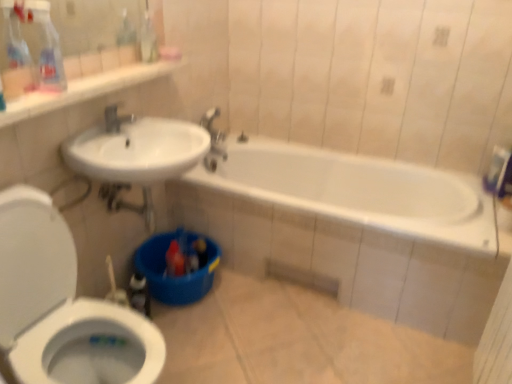
Question: From a real-world perspective, is translucent plastic spray bottle at upper left located higher than silver metallic faucet at upper center?

Choices:
 (A) yes
 (B) no

Answer: (A)

Question: Can silver metallic faucet at upper center be found inside translucent plastic spray bottle at upper left?

Choices:
 (A) no
 (B) yes

Answer: (A)

Question: Does translucent plastic spray bottle at upper left appear on the right side of silver metallic faucet at upper center?

Choices:
 (A) yes
 (B) no

Answer: (B)

Question: Is translucent plastic spray bottle at upper left further to camera compared to silver metallic faucet at upper center?

Choices:
 (A) yes
 (B) no

Answer: (B)

Question: From the image's perspective, is translucent plastic spray bottle at upper left on top of silver metallic faucet at upper center?

Choices:
 (A) yes
 (B) no

Answer: (A)

Question: Considering the relative positions of silver metallic faucet at upper center and translucent plastic spray bottle at upper left in the image provided, is silver metallic faucet at upper center to the left or to the right of translucent plastic spray bottle at upper left?

Choices:
 (A) right
 (B) left

Answer: (A)

Question: Is silver metallic faucet at upper center inside or outside of translucent plastic spray bottle at upper left?

Choices:
 (A) outside
 (B) inside

Answer: (A)

Question: Considering the positions of silver metallic faucet at upper center and translucent plastic spray bottle at upper left in the image, is silver metallic faucet at upper center bigger or smaller than translucent plastic spray bottle at upper left?

Choices:
 (A) big
 (B) small

Answer: (B)

Question: In terms of width, does silver metallic faucet at upper center look wider or thinner when compared to translucent plastic spray bottle at upper left?

Choices:
 (A) thin
 (B) wide

Answer: (B)

Question: Is silver metallic faucet at upper center in front of or behind white glossy toilet at lower left in the image?

Choices:
 (A) behind
 (B) front

Answer: (A)

Question: Is silver metallic faucet at upper center spatially inside white glossy toilet at lower left, or outside of it?

Choices:
 (A) outside
 (B) inside

Answer: (A)

Question: Considering the positions of silver metallic faucet at upper center and white glossy toilet at lower left in the image, is silver metallic faucet at upper center bigger or smaller than white glossy toilet at lower left?

Choices:
 (A) big
 (B) small

Answer: (B)

Question: From a real-world perspective, is silver metallic faucet at upper center physically located above or below white glossy toilet at lower left?

Choices:
 (A) below
 (B) above

Answer: (B)

Question: In the image, is white glossy toilet at lower left positioned in front of or behind translucent plastic spray bottle at upper left?

Choices:
 (A) behind
 (B) front

Answer: (B)

Question: From the image's perspective, is white glossy toilet at lower left positioned above or below translucent plastic spray bottle at upper left?

Choices:
 (A) above
 (B) below

Answer: (B)